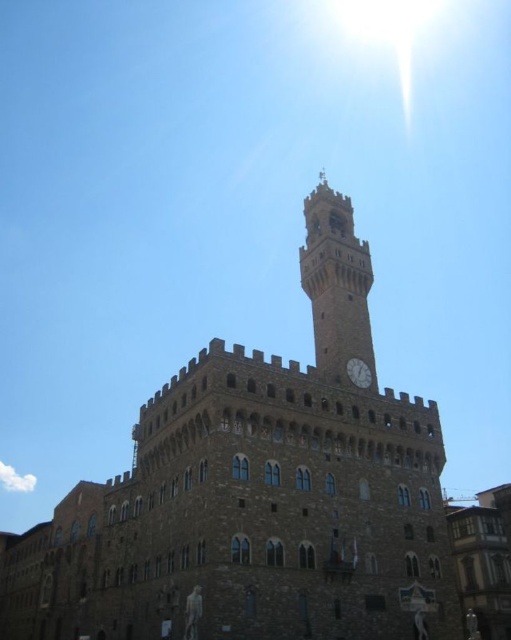
You are standing in front of a historic building with a clock tower. There is a point marked at coordinates [257,496]. What does this point represent?

The point at [257,496] corresponds to the brown stone castle at center.

You are standing in a field 100 feet away from the brown stone castle at center. You want to take a photo of the castle without any obstructions. Is your current position sufficient to capture the entire structure in the frame?

The distance between you and the brown stone castle at center is 145.85 feet, which is farther than your current position of 100 feet. Therefore, moving back to 145.85 feet would ensure the entire castle fits in the frame without obstructions.

You are an architect examining the historic building. You notice the stone clock tower at center and the white glossy clock at center. Which object is positioned higher in the image?

The stone clock tower at center is above the white glossy clock at center, so the stone clock tower at center is positioned higher.